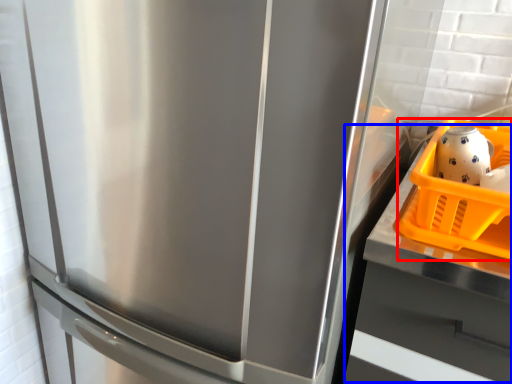
Question: Which of the following is the farthest to the observer, basket (highlighted by a red box) or counter top (highlighted by a blue box)?

Choices:
 (A) basket
 (B) counter top

Answer: (A)